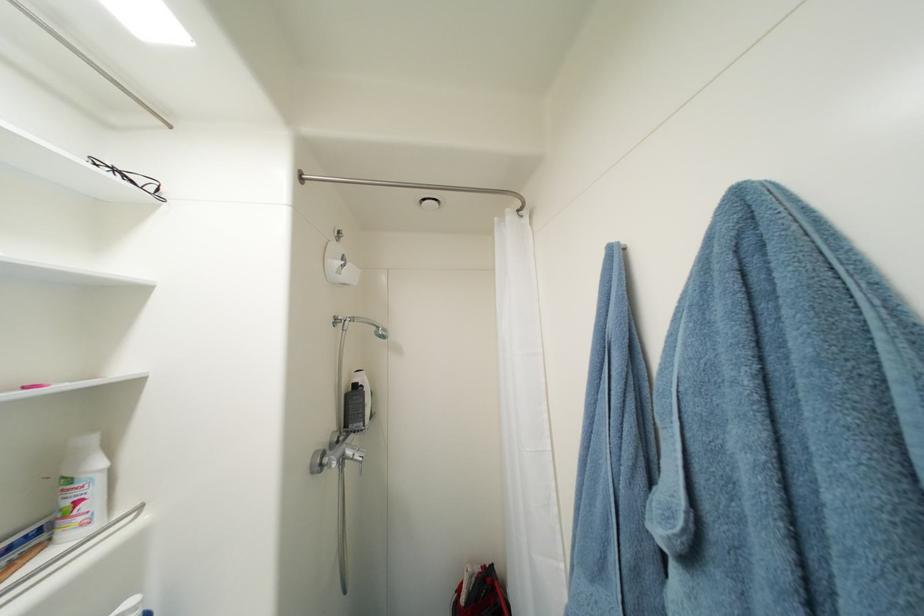
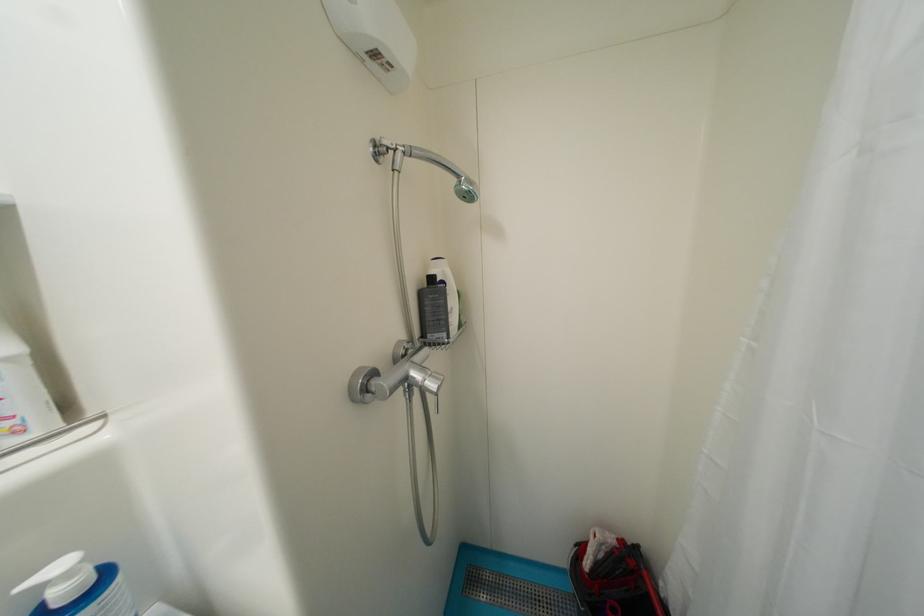
Locate, in the second image, the point that corresponds to [329,460] in the first image.

(374, 383)